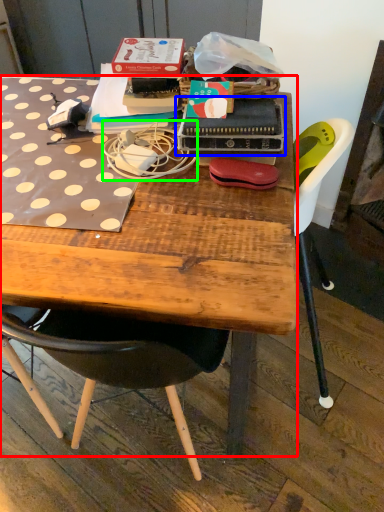
Question: Which is farther away from desk (highlighted by a red box)? paperback book (highlighted by a blue box) or string (highlighted by a green box)?

Choices:
 (A) paperback book
 (B) string

Answer: (A)